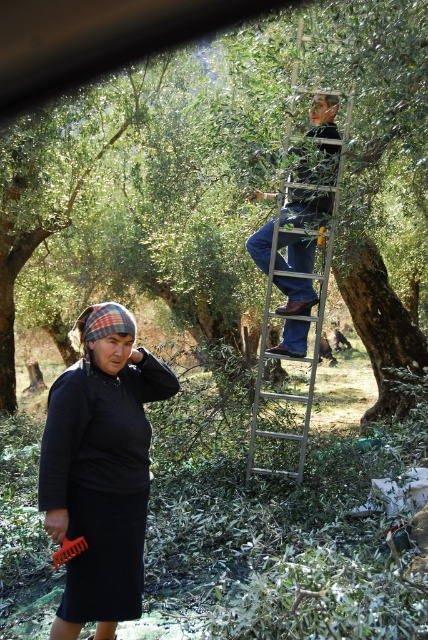
Question: Does green leafy tree at upper center have a lesser width compared to silver metallic ladder at upper center?

Choices:
 (A) yes
 (B) no

Answer: (B)

Question: Does green leafy tree at upper center have a smaller size compared to silver metallic ladder at upper center?

Choices:
 (A) no
 (B) yes

Answer: (A)

Question: Which point is farther to the camera?

Choices:
 (A) dark gray knit hat at lower left
 (B) green leafy tree at upper center
 (C) orange plastic comb at lower left

Answer: (B)

Question: Among these points, which one is nearest to the camera?

Choices:
 (A) (130, 586)
 (B) (267, 266)

Answer: (A)

Question: Which point is closer to the camera?

Choices:
 (A) (86, 460)
 (B) (279, 342)
 (C) (38, 90)

Answer: (A)

Question: Is dark gray knit hat at lower left positioned at the back of orange plastic comb at lower left?

Choices:
 (A) yes
 (B) no

Answer: (A)